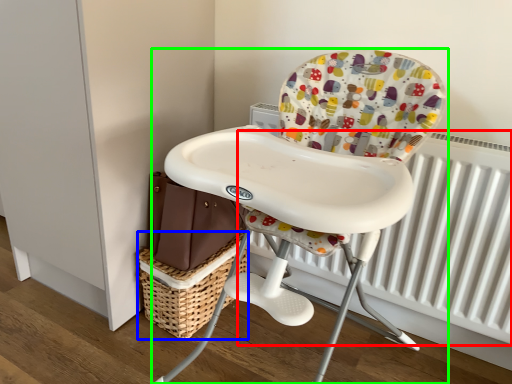
Question: Estimate the real-world distances between objects in this image. Which object is farther from radiator (highlighted by a red box), basket (highlighted by a blue box) or chair (highlighted by a green box)?

Choices:
 (A) basket
 (B) chair

Answer: (A)